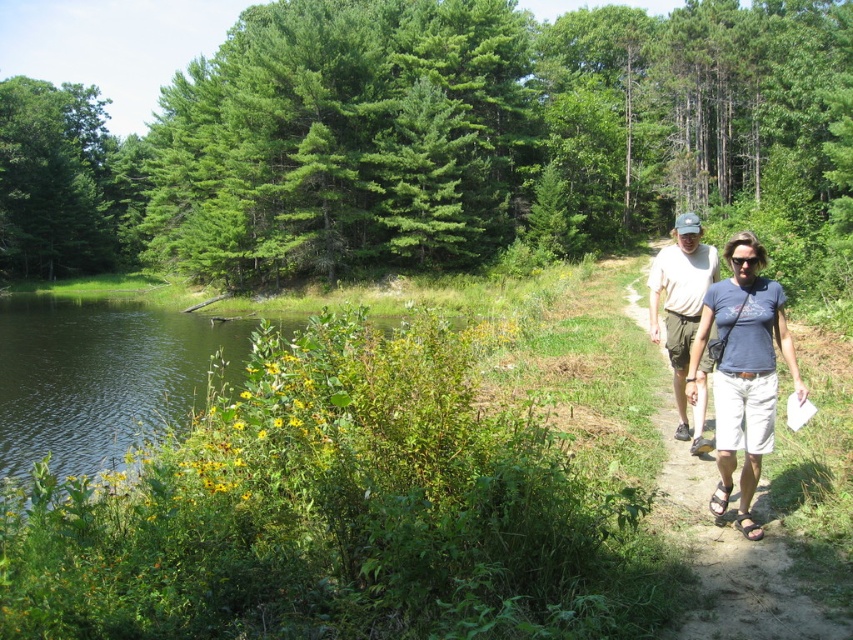
You are standing on the dirt path and see the green leafy water at lower left and the light brown shorts at right. Which object is closer to your left side?

The green leafy water at lower left is positioned on the left side of light brown shorts at right, so it is closer to your left side.

You are standing on the path and notice the green leafy water at lower left and the light brown shorts at right. Which object is higher in the scene?

The green leafy water at lower left is taller than the light brown shorts at right, so the green leafy water at lower left is higher in the scene.

Looking at this image, based on the scene description, where is the green leafy water at lower left located in terms of coordinates?

The green leafy water at lower left is located at coordinates point (97, 374).